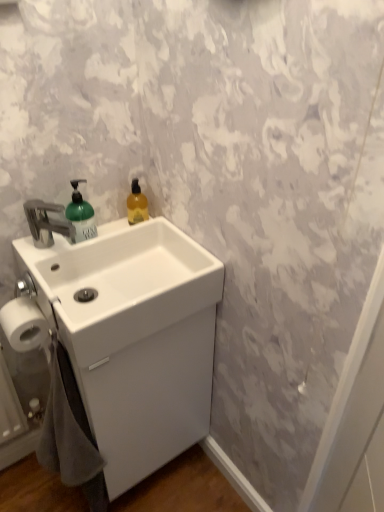
Question: From their relative heights in the image, would you say white matte toilet paper at lower left is taller or shorter than gray cotton bath towel at lower left?

Choices:
 (A) short
 (B) tall

Answer: (A)

Question: Considering the positions of point (3, 332) and point (46, 418), is point (3, 332) closer or farther from the camera than point (46, 418)?

Choices:
 (A) closer
 (B) farther

Answer: (A)

Question: Which of these objects is positioned closest to the translucent amber liquid at upper right?

Choices:
 (A) green matte soap dispenser at left
 (B) white matte toilet paper at lower left
 (C) white glossy sink at center
 (D) gray cotton bath towel at lower left
 (E) white glossy sink at center

Answer: (A)

Question: Estimate the real-world distances between objects in this image. Which object is farther from the white matte toilet paper at lower left?

Choices:
 (A) green matte soap dispenser at left
 (B) white glossy sink at center
 (C) translucent amber liquid at upper right
 (D) white glossy sink at center
 (E) gray cotton bath towel at lower left

Answer: (C)